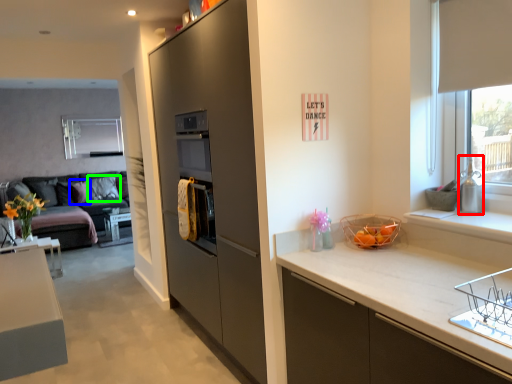
Question: Which object is positioned farthest from appliance (highlighted by a red box)? Select from pillow (highlighted by a blue box) and pillow (highlighted by a green box).

Choices:
 (A) pillow
 (B) pillow

Answer: (A)